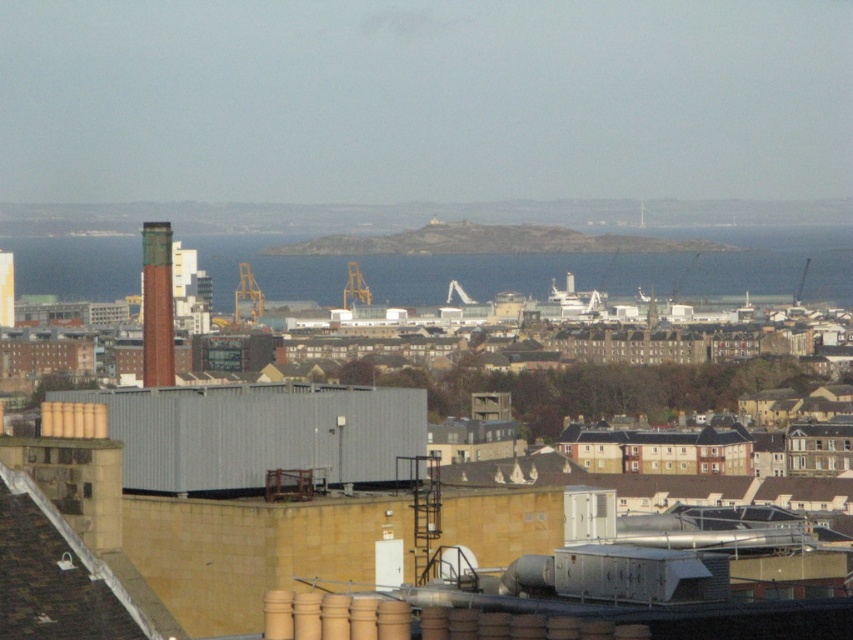
You are a city planner analyzing the urban layout. Given the blue water at center and the metallic yellow crane at center, which one occupies a larger area in the scene?

The blue water at center is bigger than the metallic yellow crane at center, so the blue water at center occupies a larger area in the scene.

You are a city planner analyzing the urban layout. Given the blue water at center and metallic yellow crane at center, which one is wider?

The blue water at center is wider than the metallic yellow crane at center according to the description.